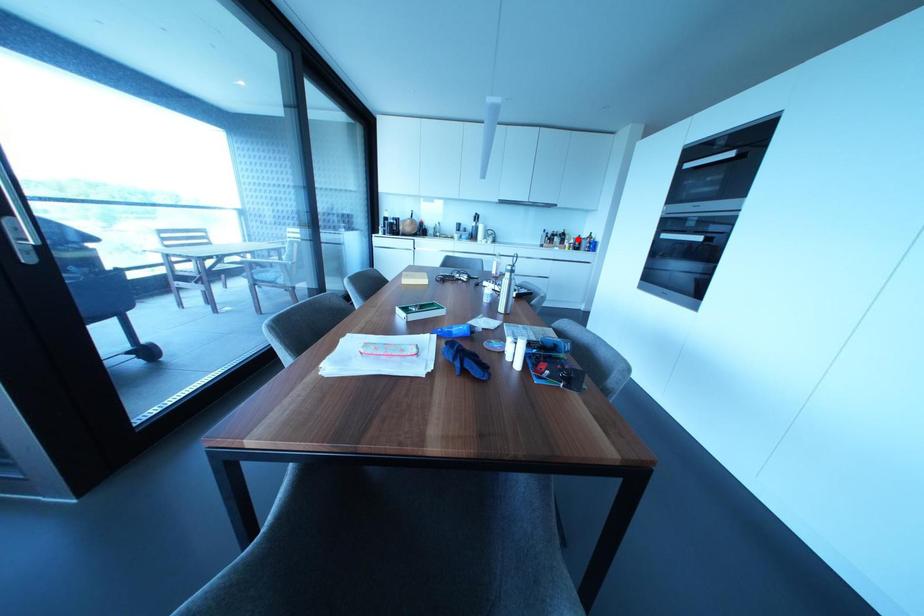
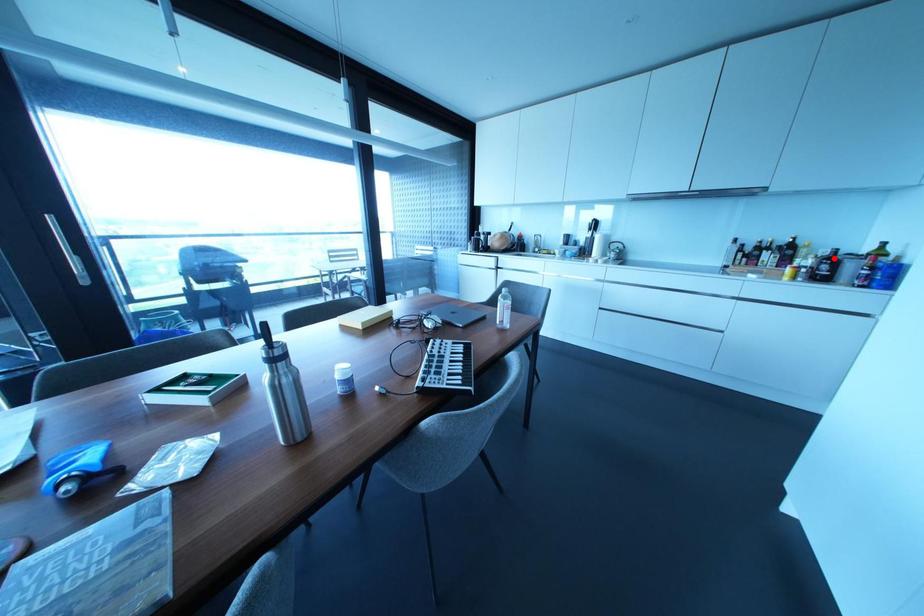
I am providing you with two images of the same scene from different viewpoints. A red point is marked on the first image and another point is marked on the second image. Is the red point in image1 aligned with the point shown in image2?

Yes